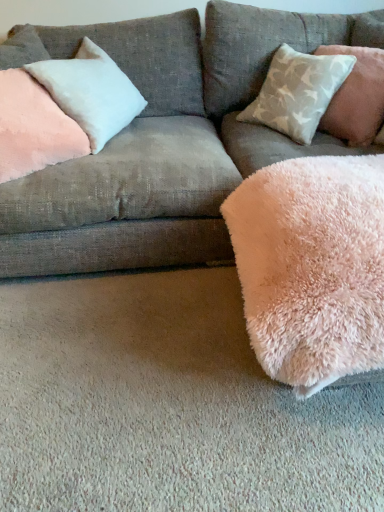
Question: Does pink plush pillow at upper left, which appears as the first pillow when viewed from the left, turn towards satin white pillow at upper left, arranged as the 2th pillow when viewed from the left?

Choices:
 (A) no
 (B) yes

Answer: (A)

Question: Is pink plush pillow at upper left, the 3th pillow when ordered from right to left, thinner than satin white pillow at upper left, arranged as the 2th pillow when viewed from the left?

Choices:
 (A) no
 (B) yes

Answer: (B)

Question: Can you confirm if pink plush pillow at upper left, which appears as the first pillow when viewed from the left, is shorter than satin white pillow at upper left, positioned as the 2th pillow in right-to-left order?

Choices:
 (A) no
 (B) yes

Answer: (A)

Question: Is pink plush pillow at upper left, which appears as the first pillow when viewed from the left, touching satin white pillow at upper left, positioned as the 2th pillow in right-to-left order?

Choices:
 (A) yes
 (B) no

Answer: (B)

Question: Can you confirm if pink plush pillow at upper left, which appears as the first pillow when viewed from the left, is positioned to the right of satin white pillow at upper left, positioned as the 2th pillow in right-to-left order?

Choices:
 (A) no
 (B) yes

Answer: (A)

Question: From the image's perspective, would you say pink plush pillow at upper left, which appears as the first pillow when viewed from the left, is shown under satin white pillow at upper left, positioned as the 2th pillow in right-to-left order?

Choices:
 (A) no
 (B) yes

Answer: (B)

Question: Considering the relative sizes of pink plush pillow at upper left, the 3th pillow when ordered from right to left, and velvet pink pillow at upper left in the image provided, is pink plush pillow at upper left, the 3th pillow when ordered from right to left, smaller than velvet pink pillow at upper left?

Choices:
 (A) no
 (B) yes

Answer: (B)

Question: Does pink plush pillow at upper left, which appears as the first pillow when viewed from the left, come behind velvet pink pillow at upper left?

Choices:
 (A) no
 (B) yes

Answer: (B)

Question: Can you confirm if pink plush pillow at upper left, which appears as the first pillow when viewed from the left, is bigger than velvet pink pillow at upper left?

Choices:
 (A) yes
 (B) no

Answer: (B)

Question: Does pink plush pillow at upper left, which appears as the first pillow when viewed from the left, appear on the left side of velvet pink pillow at upper left?

Choices:
 (A) yes
 (B) no

Answer: (A)

Question: Is pink plush pillow at upper left, which appears as the first pillow when viewed from the left, not within velvet pink pillow at upper left?

Choices:
 (A) yes
 (B) no

Answer: (B)

Question: Considering the relative sizes of pink plush pillow at upper left, which appears as the first pillow when viewed from the left, and velvet pink pillow at upper left in the image provided, is pink plush pillow at upper left, which appears as the first pillow when viewed from the left, taller than velvet pink pillow at upper left?

Choices:
 (A) no
 (B) yes

Answer: (A)

Question: Is velvet pink pillow at upper left positioned beyond the bounds of light gray textured pillow at upper right, which appears as the first pillow when viewed from the right?

Choices:
 (A) yes
 (B) no

Answer: (A)